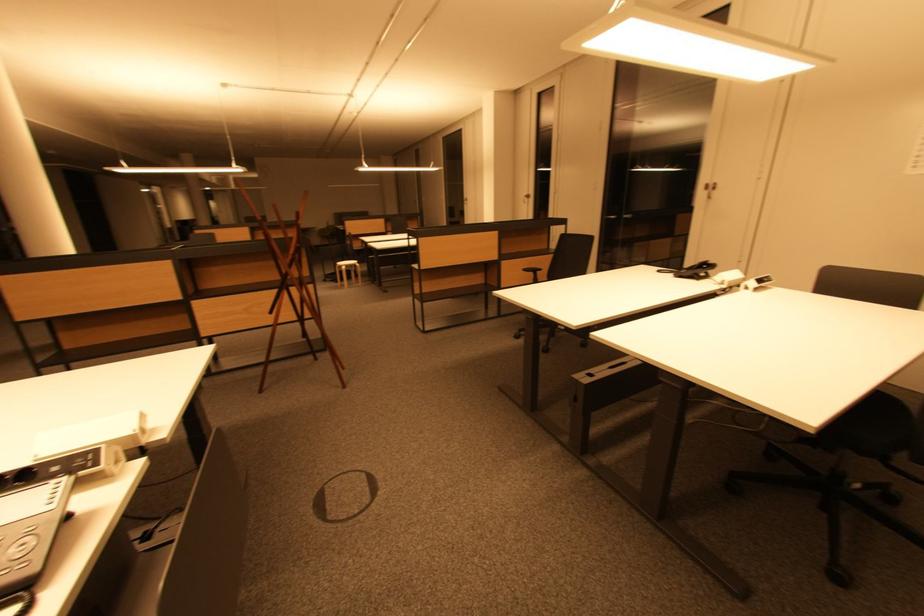
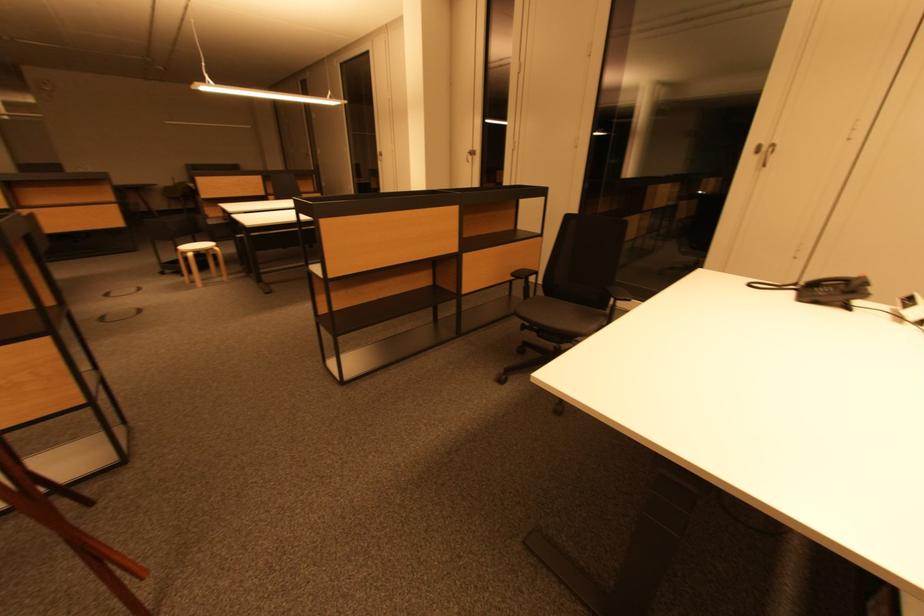
Find the pixel in the second image that matches the point at 529,197 in the first image.

(470, 152)